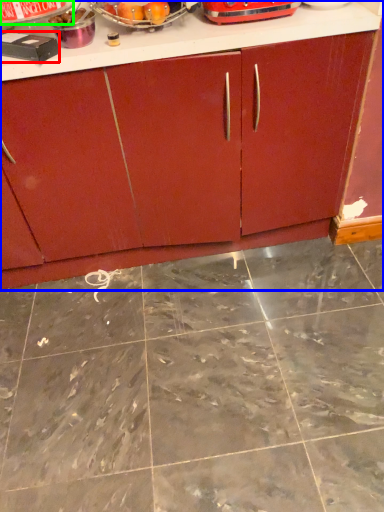
Question: Which is nearer to the appliance (highlighted by a red box)? cabinetry (highlighted by a blue box) or appliance (highlighted by a green box).

Choices:
 (A) cabinetry
 (B) appliance

Answer: (B)